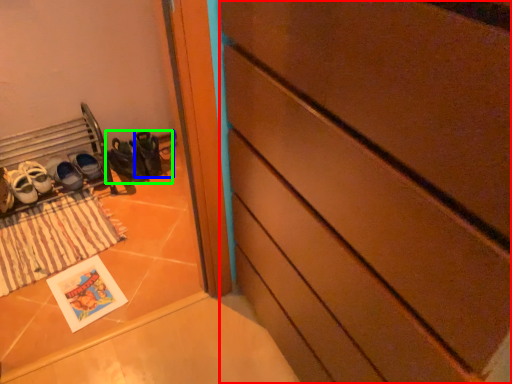
Question: Which object is positioned closest to chest of drawers (highlighted by a red box)? Select from shoe (highlighted by a blue box) and footwear (highlighted by a green box).

Choices:
 (A) shoe
 (B) footwear

Answer: (B)